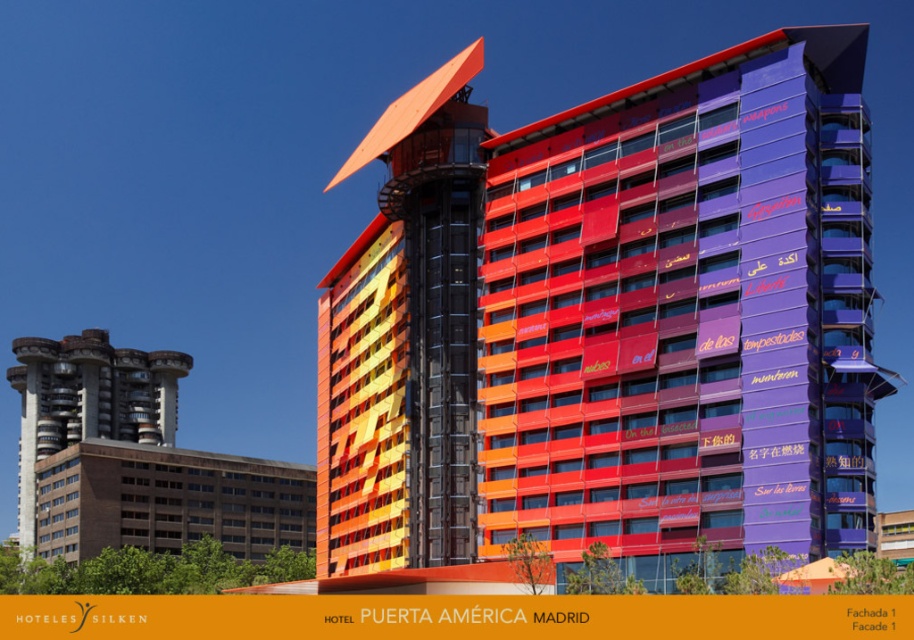
Does multicolored glass building at center lie behind brown brick building at lower left?

No.

What do you see at coordinates (677, 308) in the screenshot?
I see `multicolored glass building at center` at bounding box center [677, 308].

Locate an element on the screen. multicolored glass building at center is located at coordinates (677, 308).

Who is positioned more to the left, multicolored glass elevator at center or brown brick building at lower left?

brown brick building at lower left is more to the left.

Is point (443, 195) in front of point (256, 493)?

Yes.

Identify the location of multicolored glass elevator at center. (405, 340).

Which is in front, point (716, 481) or point (319, 305)?

Point (716, 481) is more forward.

Is point (455, 561) farther from viewer compared to point (360, 269)?

No.

Locate an element on the screen. The image size is (914, 640). multicolored glass building at center is located at coordinates (677, 308).